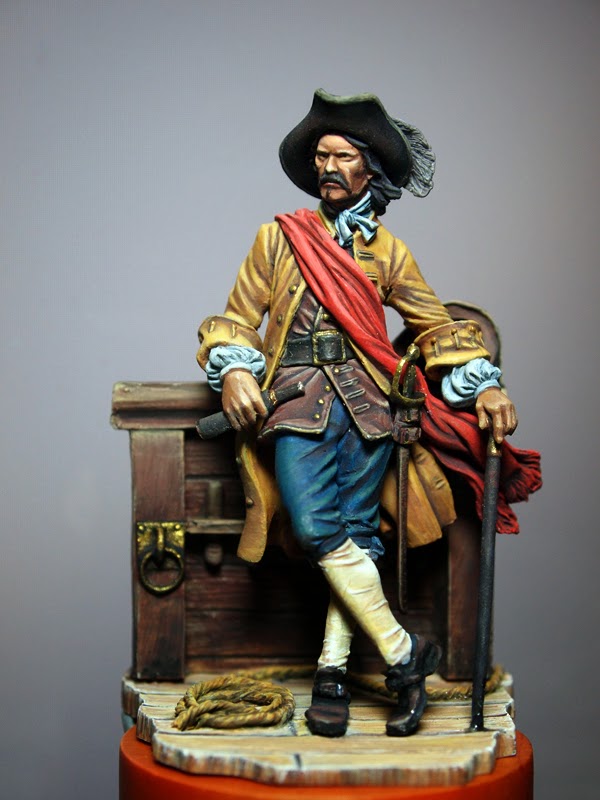
Where is `pirate captain figurine`? pirate captain figurine is located at coordinates (341, 370).